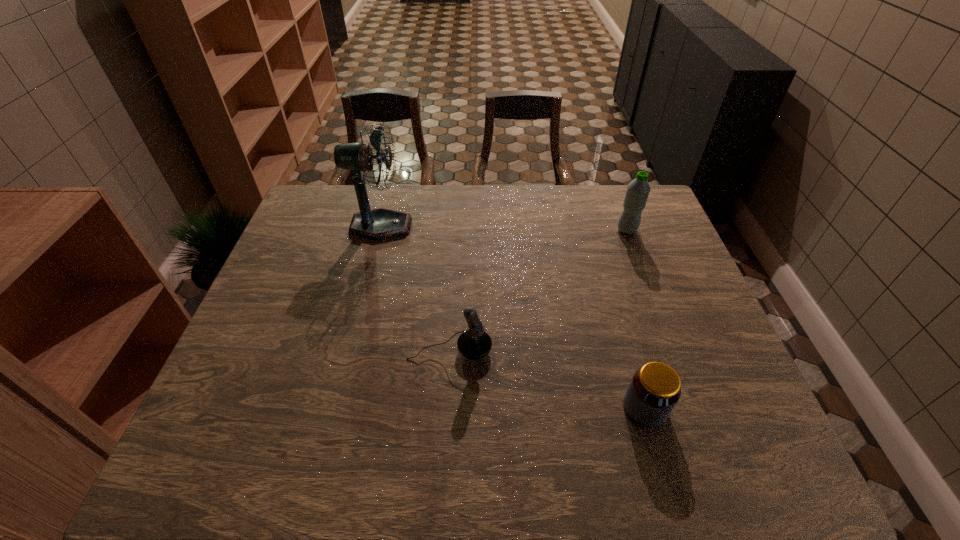
You are a GUI agent. You are given a task and a screenshot of the screen. Output one action in this format:
    pyautogui.click(x=<x>, y=<y>)
    Task: Click on the free space at the far left corner of the desktop
    
    Given the screenshot: What is the action you would take?
    pyautogui.click(x=345, y=221)

At what (x,y) coordinates should I click in order to perform the action: click on vacant space at the far right corner of the desktop. Please return your answer as a coordinate pair (x, y). The width and height of the screenshot is (960, 540). Looking at the image, I should click on (667, 225).

Identify the location of vacant point located between the tallest object and the nearest object. (513, 318).

Identify the location of free spot between the jar and the fan. The height and width of the screenshot is (540, 960). coord(513,318).

Identify the location of vacant space that's between the leftmost object and the second nearest object. (416, 288).

At what (x,y) coordinates should I click in order to perform the action: click on free space between the jar and the microphone. Please return your answer as a coordinate pair (x, y). Looking at the image, I should click on (547, 380).

At what (x,y) coordinates should I click in order to perform the action: click on vacant space that is in between the fan and the third farthest object. Please return your answer as a coordinate pair (x, y). Looking at the image, I should click on (416, 288).

Find the location of a particular element. The height and width of the screenshot is (540, 960). free area in between the fan and the water bottle is located at coordinates pyautogui.click(x=504, y=228).

Identify the location of empty space that is in between the fan and the third tallest object. The width and height of the screenshot is (960, 540). (416, 288).

Locate an element on the screen. Image resolution: width=960 pixels, height=540 pixels. free area in between the leftmost object and the nearest object is located at coordinates (513, 318).